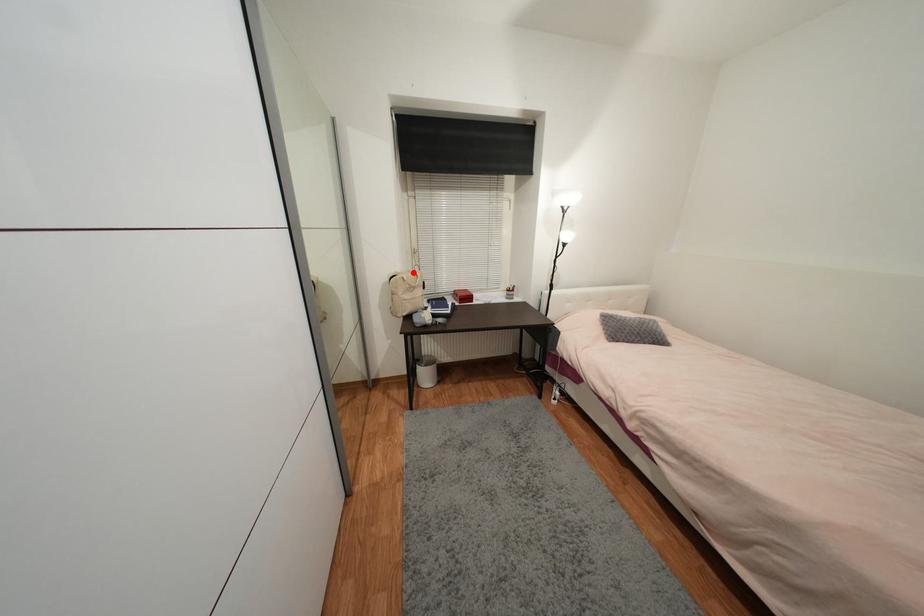
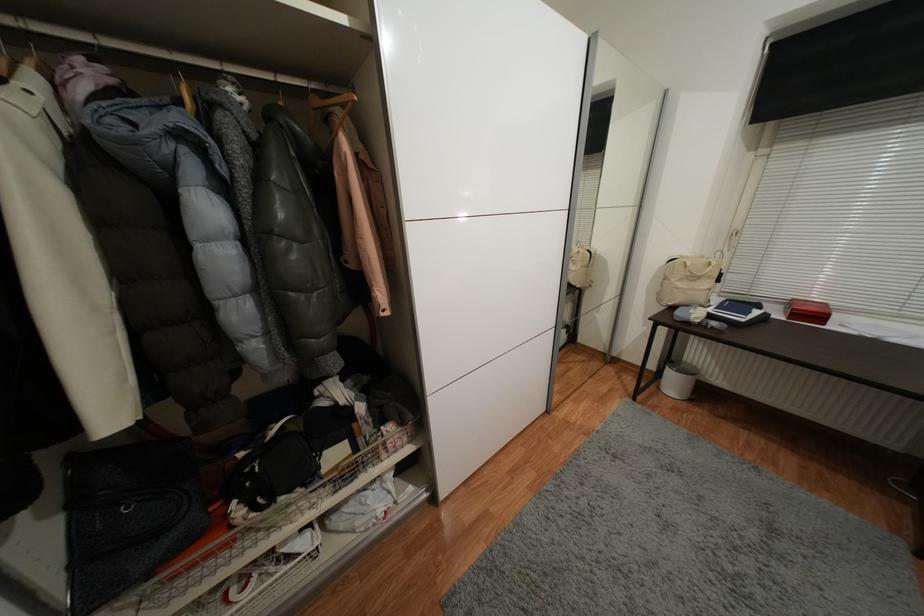
In the second image, find the point that corresponds to the highlighted location in the first image.

(707, 257)